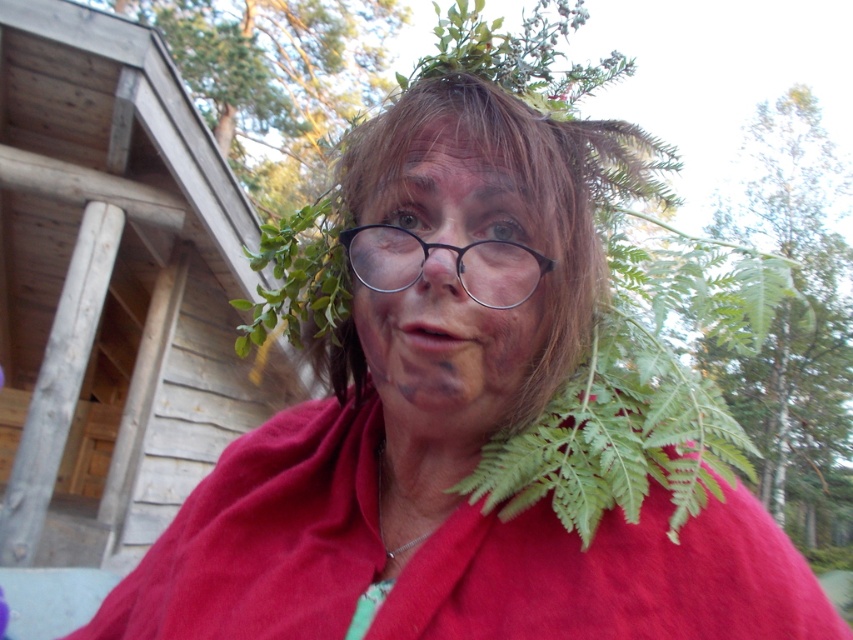
You are an artist trying to sketch the person in the image. You notice the matte black face at center and the metallic round glasses at center. Which object should you draw first if you want to ensure proper proportions, considering their sizes?

You should draw the metallic round glasses at center first since they are wider than the matte black face at center, allowing you to establish their larger size before detailing the face.

You are an artist sketching the person in the image. You need to draw the matte black face at center and the metallic round glasses at center. Which object should you draw first if you want to follow the correct vertical order from top to bottom?

The metallic round glasses at center are positioned above the matte black face at center, so you should draw the metallic round glasses at center first before drawing the matte black face at center.

Consider the image. You are standing at the wooden cabin in the background and want to walk towards the person in the image. Which point, point (469,372) or point (497,257), would you pass first?

You would pass point (469,372) first because it is in front of point (497,257) from your perspective at the wooden cabin.